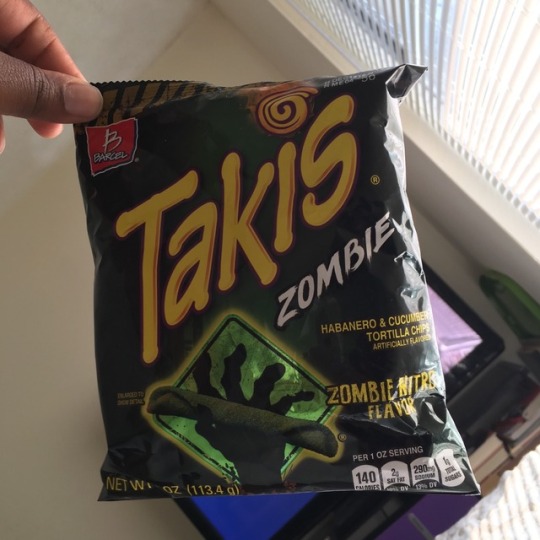
Identify the location of monitor. click(x=451, y=343).